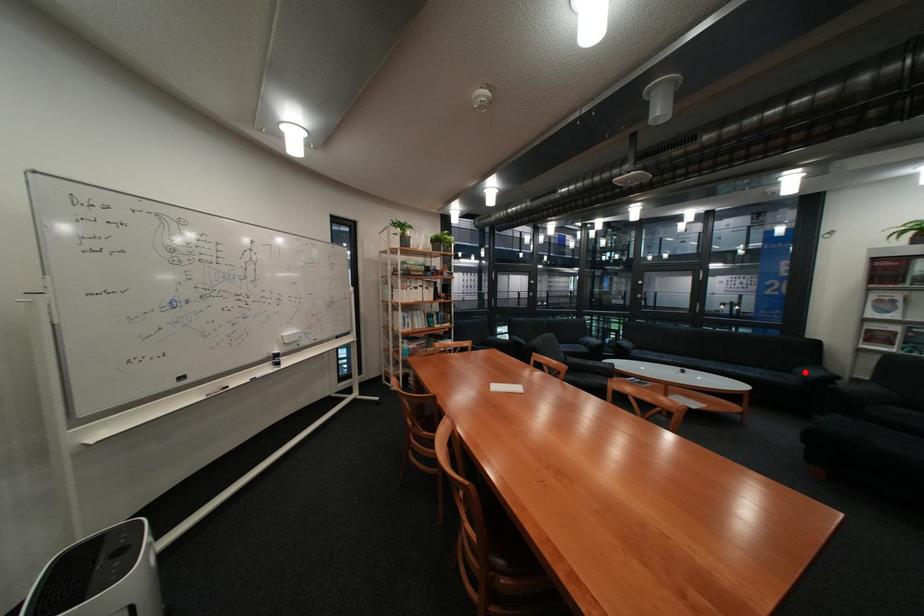
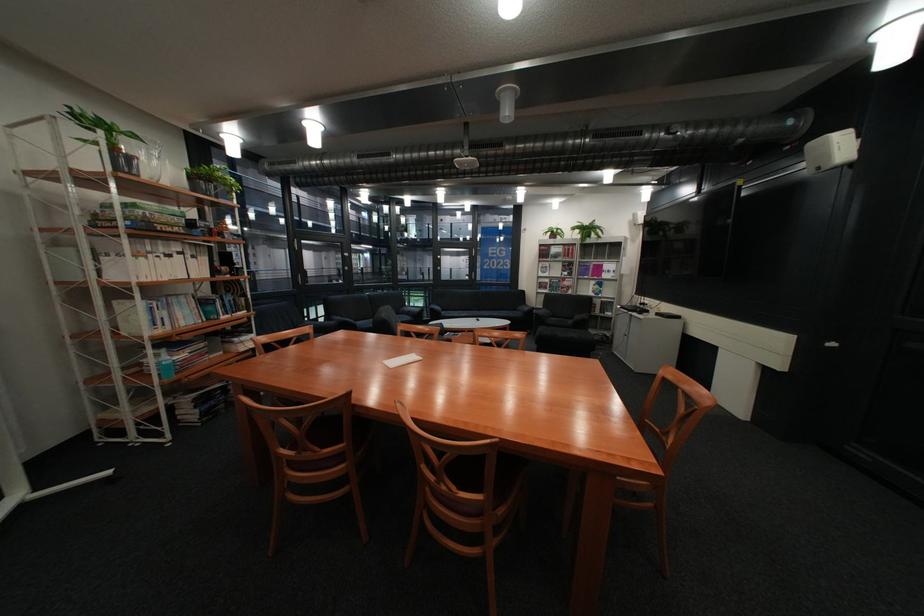
The point at the highlighted location is marked in the first image. Where is the corresponding point in the second image?

(531, 310)